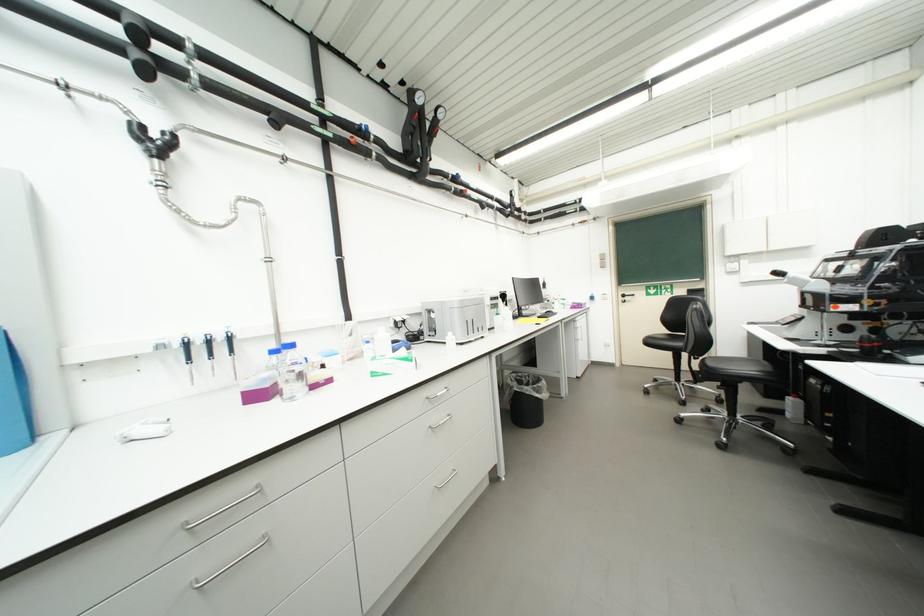
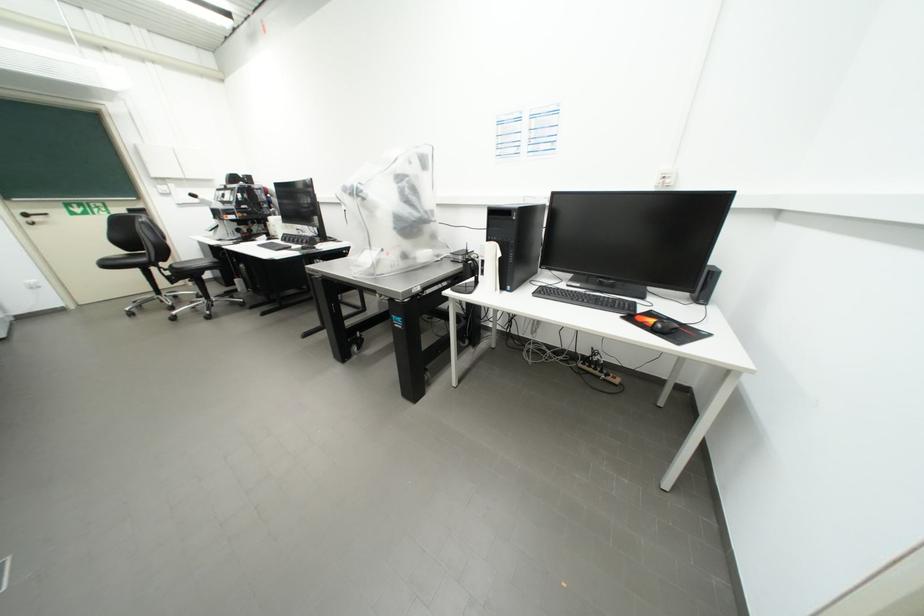
Locate, in the second image, the point that corresponds to (x=679, y=381) in the first image.

(160, 296)